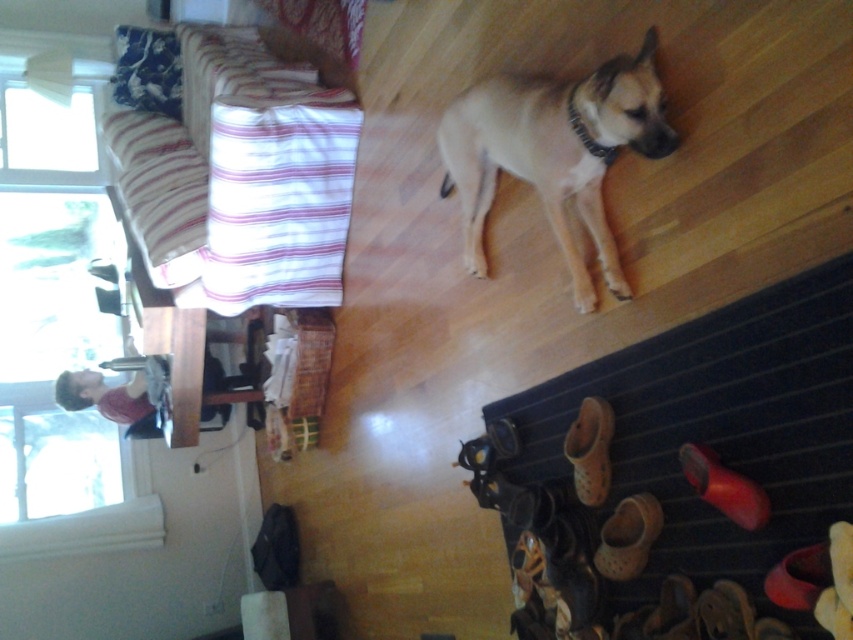
Consider the image. You are standing at the point marked as point [605,472] in the image. You want to walk towards the sofa with the striped pink and white cushion. Is there enough space to move freely between the point and the sofa?

The distance between you and the sofa with the striped pink and white cushion is 1.99 meters. Since this distance is sufficient for typical movement, there is enough space to move freely between the point and the sofa.